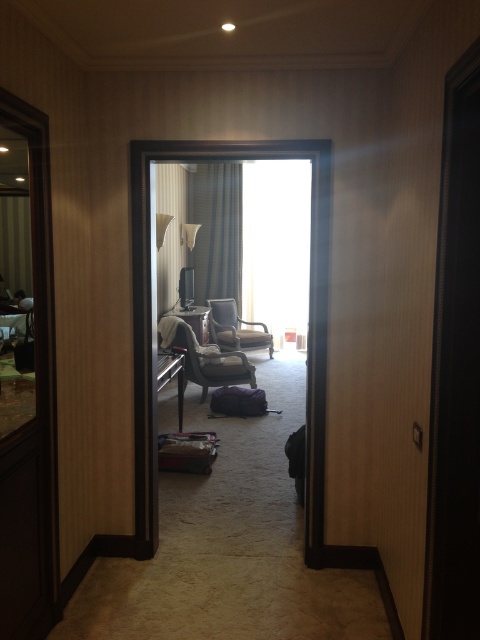
Question: Which of these objects is positioned closest to the transparent glass door at left?

Choices:
 (A) white textured curtain at upper left
 (B) satin black armchair at center
 (C) velvet gray armchair at left

Answer: (C)

Question: Is transparent glass door at left bigger than white textured curtain at upper left?

Choices:
 (A) no
 (B) yes

Answer: (A)

Question: Estimate the real-world distances between objects in this image. Which object is farther from the white textured curtain at upper left?

Choices:
 (A) matte gray curtain at center
 (B) velvet gray armchair at left

Answer: (B)

Question: Considering the relative positions of transparent glass door at left and black wood door at right in the image provided, where is transparent glass door at left located with respect to black wood door at right?

Choices:
 (A) right
 (B) left

Answer: (B)

Question: Where is black wood door at right located in relation to matte gray curtain at center in the image?

Choices:
 (A) below
 (B) above

Answer: (A)

Question: Which object is farther from the camera taking this photo?

Choices:
 (A) black wood door at right
 (B) velvet gray armchair at left
 (C) matte gray curtain at center

Answer: (C)